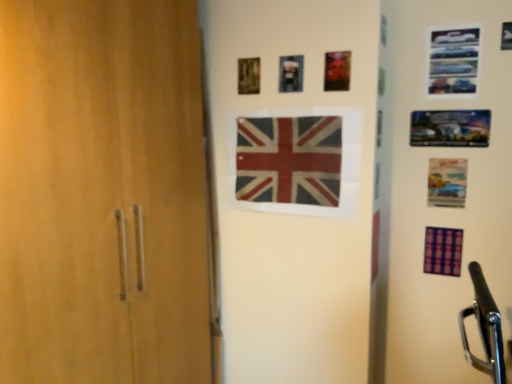
Question: Can you confirm if metallic blue picture frame at upper right, which appears as the fourth picture frame when viewed from the left, is wider than metallic photo frame at upper right, which is the 3th picture frame in left-to-right order?

Choices:
 (A) yes
 (B) no

Answer: (B)

Question: Does metallic blue picture frame at upper right, which appears as the fourth picture frame when viewed from the left, have a larger size compared to metallic photo frame at upper right, positioned as the second picture frame in right-to-left order?

Choices:
 (A) no
 (B) yes

Answer: (B)

Question: Does metallic blue picture frame at upper right, which appears as the fourth picture frame when viewed from the left, come in front of metallic photo frame at upper right, which is the 3th picture frame in left-to-right order?

Choices:
 (A) no
 (B) yes

Answer: (B)

Question: Is metallic blue picture frame at upper right, which appears as the fourth picture frame when viewed from the left, next to metallic photo frame at upper right, which is the 3th picture frame in left-to-right order?

Choices:
 (A) no
 (B) yes

Answer: (A)

Question: Is metallic blue picture frame at upper right, which ranks as the 1th picture frame in right-to-left order, smaller than metallic photo frame at upper right, positioned as the second picture frame in right-to-left order?

Choices:
 (A) no
 (B) yes

Answer: (A)

Question: From the image's perspective, relative to purple fabric flag at lower right, marked as the 1th flag in a bottom-to-top arrangement, is wooden picture frame at upper center, placed as the first picture frame when sorted from left to right, above or below?

Choices:
 (A) above
 (B) below

Answer: (A)

Question: Is point (244, 76) positioned closer to the camera than point (449, 269)?

Choices:
 (A) closer
 (B) farther

Answer: (A)

Question: From a real-world perspective, is wooden picture frame at upper center, placed as the first picture frame when sorted from left to right, physically located above or below purple fabric flag at lower right, the 2th flag when ordered from top to bottom?

Choices:
 (A) below
 (B) above

Answer: (B)

Question: Relative to purple fabric flag at lower right, which is the 1th flag from right to left, is wooden picture frame at upper center, which is the fourth picture frame in right-to-left order, in front or behind?

Choices:
 (A) behind
 (B) front

Answer: (B)

Question: In the image, is metallic photo frame at upper right, positioned as the second picture frame in right-to-left order, on the left side or the right side of wooden picture frame at upper center, placed as the first picture frame when sorted from left to right?

Choices:
 (A) left
 (B) right

Answer: (B)

Question: Which is correct: metallic photo frame at upper right, which is the 3th picture frame in left-to-right order, is inside wooden picture frame at upper center, placed as the first picture frame when sorted from left to right, or outside of it?

Choices:
 (A) outside
 (B) inside

Answer: (A)

Question: Is point (473, 132) closer or farther from the camera than point (240, 89)?

Choices:
 (A) closer
 (B) farther

Answer: (A)

Question: From the image's perspective, is metallic photo frame at upper right, positioned as the second picture frame in right-to-left order, above or below wooden picture frame at upper center, which is the fourth picture frame in right-to-left order?

Choices:
 (A) below
 (B) above

Answer: (A)

Question: Is metallic silver picture frame at upper center, placed as the 2th picture frame when sorted from left to right, inside the boundaries of purple fabric flag at lower right, which is counted as the 2th flag, starting from the left, or outside?

Choices:
 (A) outside
 (B) inside

Answer: (A)

Question: From a real-world perspective, is metallic silver picture frame at upper center, placed as the 2th picture frame when sorted from left to right, positioned above or below purple fabric flag at lower right, which is the 1th flag from right to left?

Choices:
 (A) below
 (B) above

Answer: (B)